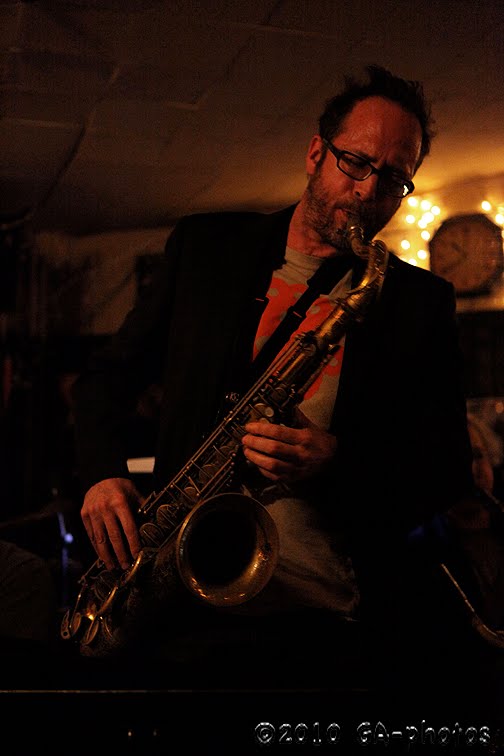
What are the coordinates of `clock` in the screenshot? It's located at (476, 255).